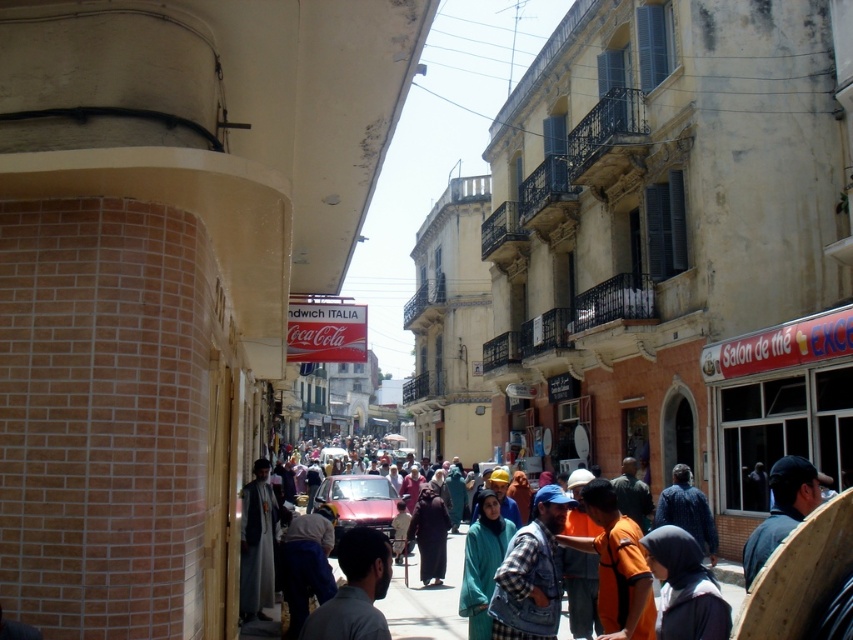
You are a photographer trying to capture a shot of the dark brown fabric at center without the matte black hijab at lower right blocking it. Based on their heights, is this possible?

The matte black hijab at lower right is not as tall as dark brown fabric at center, so the hijab is shorter than the fabric. Therefore, it might still be possible to position yourself or adjust the angle so that the shorter hijab does not block the view of the taller fabric.

You are a photographer trying to capture a candid shot of the dark gray shirt at center and the dark brown fabric at center in the bustling street scene. Since you want to ensure both subjects are fully visible in your frame, which subject requires a wider angle to accommodate its size?

The dark gray shirt at center requires a wider angle because its width surpasses that of the dark brown fabric at center, meaning it occupies more space and needs a larger frame to be fully captured.